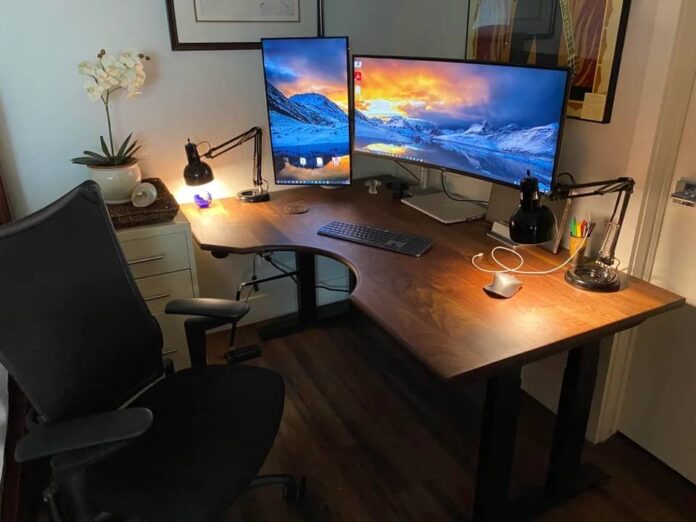
Find the location of `computer mouse`. computer mouse is located at coordinates (507, 284).